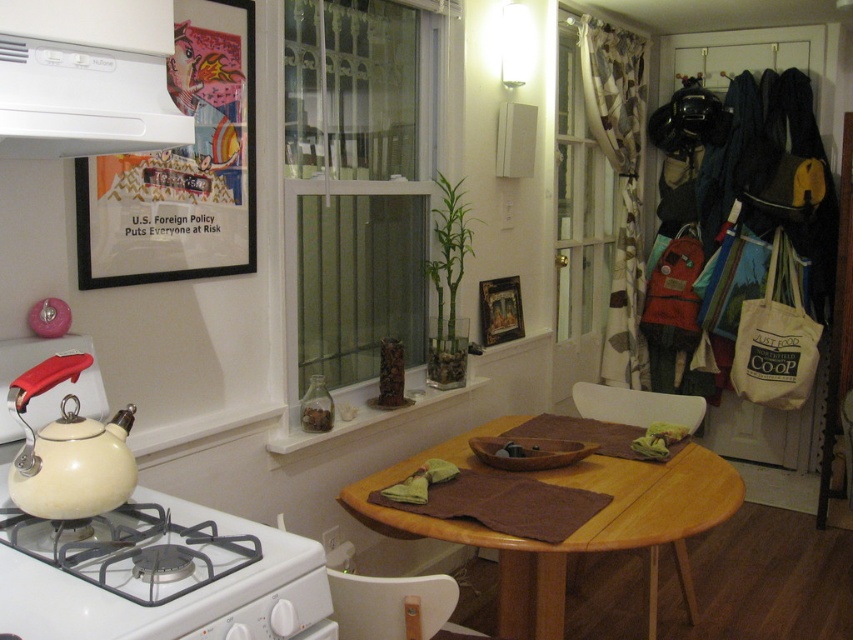
Question: Is green glass window at center below white plastic exhaust hood at upper left?

Choices:
 (A) yes
 (B) no

Answer: (B)

Question: Which point appears closest to the camera in this image?

Choices:
 (A) (573, 248)
 (B) (200, 56)
 (C) (111, 116)
 (D) (102, 534)

Answer: (C)

Question: Where is green glass window at center located in relation to white plastic exhaust hood at upper left in the image?

Choices:
 (A) above
 (B) below

Answer: (A)

Question: Which of the following is the closest to the observer?

Choices:
 (A) (595, 266)
 (B) (651, 474)

Answer: (B)

Question: Considering the real-world distances, which object is closest to the cream matte teapot at stove front?

Choices:
 (A) white matte gas stove at lower left
 (B) green glass window at center
 (C) wooden table at center

Answer: (A)

Question: From the image, what is the correct spatial relationship of matte black frame at upper left in relation to white matte gas stove at lower left?

Choices:
 (A) right
 (B) left

Answer: (B)